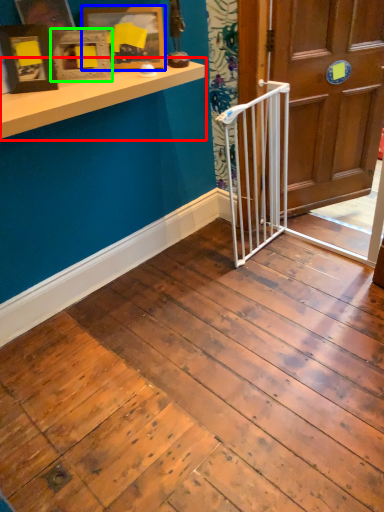
Question: Which is nearer to the window sill (highlighted by a red box)? picture frame (highlighted by a blue box) or picture frame (highlighted by a green box).

Choices:
 (A) picture frame
 (B) picture frame

Answer: (B)